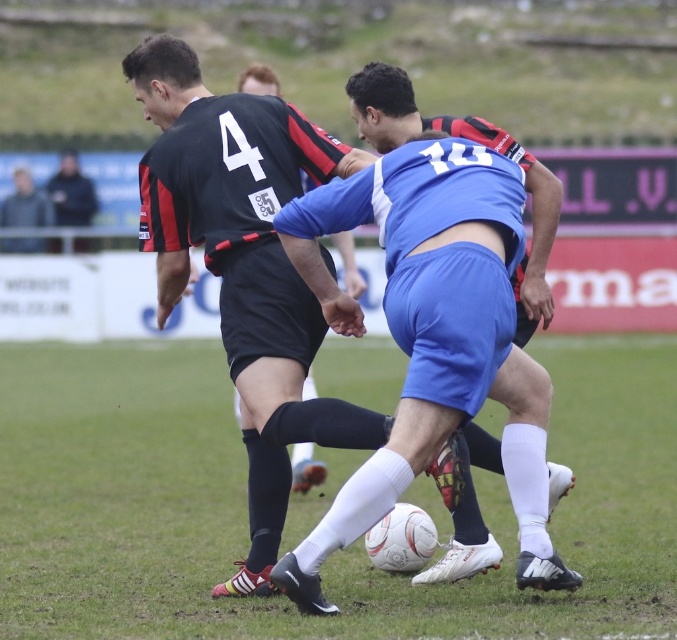
Question: Does dark blue jacket at upper left appear under gray fabric jacket at upper left?

Choices:
 (A) yes
 (B) no

Answer: (B)

Question: From the image, what is the correct spatial relationship of white textured football at center in relation to dark blue jacket at upper left?

Choices:
 (A) above
 (B) below

Answer: (B)

Question: Which object appears farthest from the camera in this image?

Choices:
 (A) gray fabric jacket at upper left
 (B) dark blue jacket at upper left

Answer: (B)

Question: Which is nearer to the blue matte shorts at center?

Choices:
 (A) white textured football at center
 (B) gray fabric jacket at upper left

Answer: (A)

Question: Which of the following is the farthest from the observer?

Choices:
 (A) dark blue jacket at upper left
 (B) blue matte shorts at center
 (C) white textured football at center
 (D) black matte shorts at center

Answer: (A)

Question: Is dark blue jacket at upper left to the left of gray fabric jacket at upper left from the viewer's perspective?

Choices:
 (A) yes
 (B) no

Answer: (B)